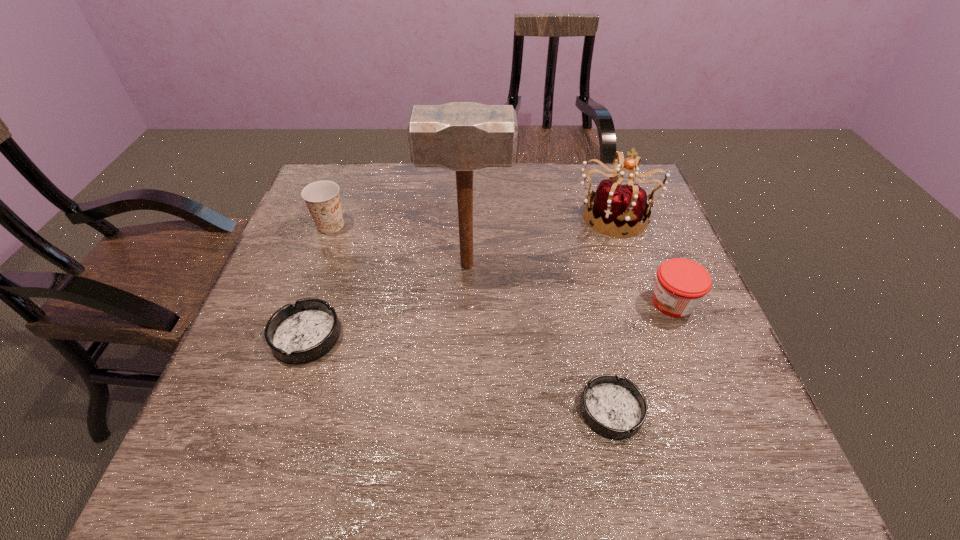
At what (x,y) coordinates should I click in order to perform the action: click on empty space that is in between the shorter ashtray and the jam. Please return your answer as a coordinate pair (x, y). Looking at the image, I should click on (642, 356).

Identify the location of empty space that is in between the tallest object and the Dixie cup. (398, 245).

Locate an element on the screen. The height and width of the screenshot is (540, 960). vacant space that's between the jam and the nearest object is located at coordinates coord(642,356).

This screenshot has height=540, width=960. I want to click on blank region between the fourth shortest object and the fourth tallest object, so [502, 264].

Where is `vacant space that is in between the fifth tallest object and the tiara`? The width and height of the screenshot is (960, 540). vacant space that is in between the fifth tallest object and the tiara is located at coordinates (460, 276).

Find the location of a particular element. Image resolution: width=960 pixels, height=540 pixels. free space that is in between the nearest object and the fifth tallest object is located at coordinates (459, 373).

I want to click on empty space that is in between the nearer ashtray and the tallest object, so click(x=540, y=338).

Find the location of `vacant space that is in between the tallest object and the farther ashtray`. vacant space that is in between the tallest object and the farther ashtray is located at coordinates (387, 301).

What are the coordinates of `blank region between the taller ashtray and the tiara` in the screenshot? It's located at (460, 276).

Identify the location of the third closest object to the fourth object from right to left. This screenshot has height=540, width=960. coord(322,198).